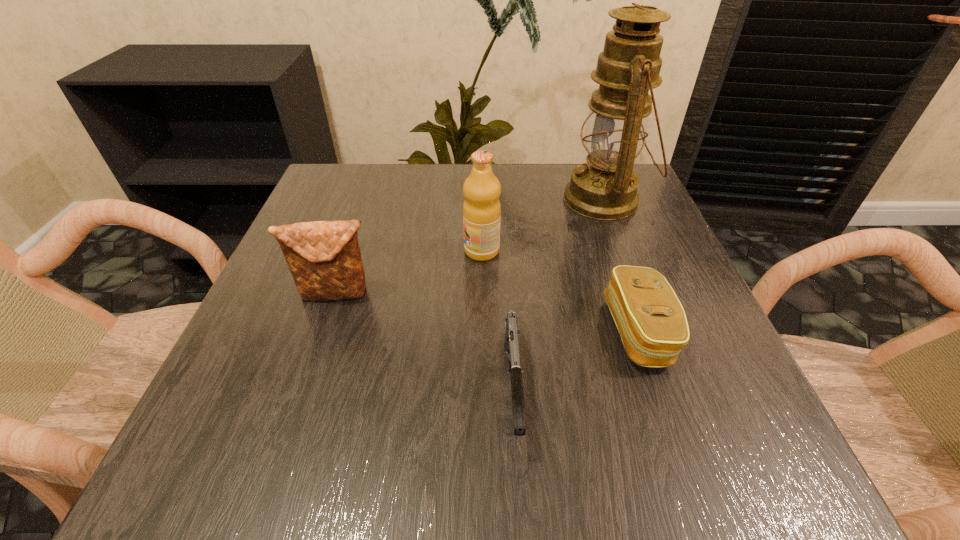
Where is `vacant space in between the shorter clutch bag and the left clutch bag`? The image size is (960, 540). vacant space in between the shorter clutch bag and the left clutch bag is located at coordinates (488, 313).

You are a GUI agent. You are given a task and a screenshot of the screen. Output one action in this format:
    pyautogui.click(x=<x>, y=<y>)
    Task: Click on the vacant space in between the fourth shortest object and the oil lamp
    
    Given the screenshot: What is the action you would take?
    pyautogui.click(x=543, y=225)

The width and height of the screenshot is (960, 540). In order to click on vacant region between the leftmost object and the right clutch bag in this screenshot , I will do `click(488, 313)`.

Locate an element on the screen. vacant area between the second tallest object and the right clutch bag is located at coordinates (560, 291).

Identify the location of the closest object to the tallest object. pyautogui.click(x=481, y=210).

Identify which object is the third nearest to the tallest object. Please provide its 2D coordinates. Your answer should be formatted as a tuple, i.e. [(x, y)], where the tuple contains the x and y coordinates of a point satisfying the conditions above.

[(512, 332)]

Where is `vacant region that satisfies the following two spatial constraints: 1. on the zipper side of the shorter clutch bag; 2. at the muzzle end of the gun`? The image size is (960, 540). vacant region that satisfies the following two spatial constraints: 1. on the zipper side of the shorter clutch bag; 2. at the muzzle end of the gun is located at coordinates (658, 389).

Identify the location of free spot that satisfies the following two spatial constraints: 1. on the zipper side of the right clutch bag; 2. at the muzzle end of the gun. The height and width of the screenshot is (540, 960). (658, 389).

Locate an element on the screen. The image size is (960, 540). free space in the image that satisfies the following two spatial constraints: 1. on the front side of the farthest object; 2. on the zipper side of the right clutch bag is located at coordinates (654, 332).

Locate an element on the screen. vacant space that satisfies the following two spatial constraints: 1. on the front label of the fruit juice; 2. on the open side of the third tallest object is located at coordinates (482, 294).